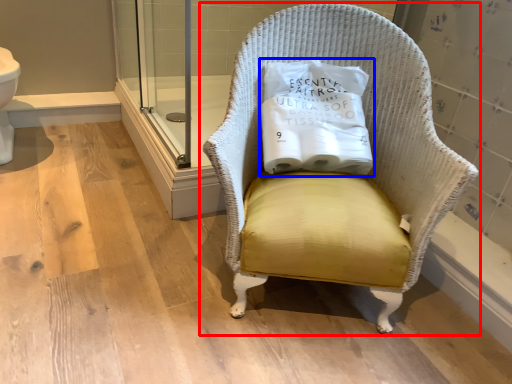
Question: Which object appears closest to the camera in this image, chair (highlighted by a red box) or pillow (highlighted by a blue box)?

Choices:
 (A) chair
 (B) pillow

Answer: (A)